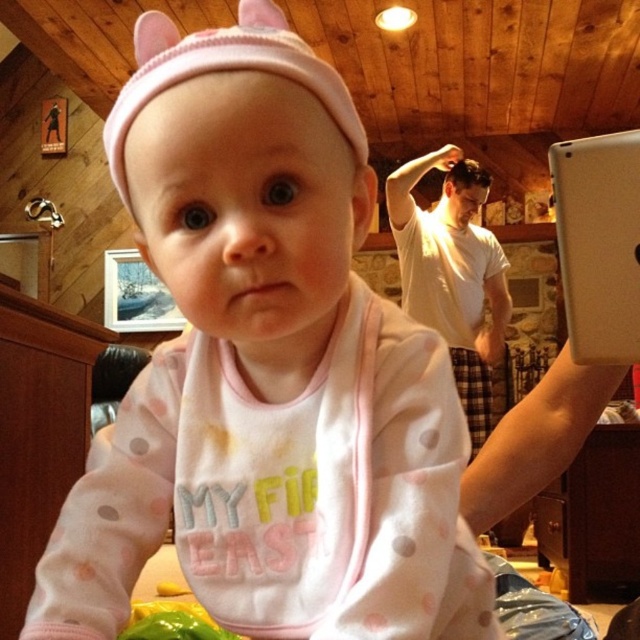
Question: Does pink fabric bib at center have a greater width compared to pink knit hat at upper center?

Choices:
 (A) no
 (B) yes

Answer: (A)

Question: Among these points, which one is nearest to the camera?

Choices:
 (A) (113, 144)
 (B) (616, 340)
 (C) (364, 461)

Answer: (A)

Question: In this image, where is white matte tablet at upper right located relative to pink knit hat at upper center?

Choices:
 (A) left
 (B) right

Answer: (B)

Question: Which of the following is the closest to the observer?

Choices:
 (A) (586, 244)
 (B) (317, 429)
 (C) (134, 108)

Answer: (C)

Question: Can you confirm if white matte tablet at upper right is positioned above pink knit hat at upper center?

Choices:
 (A) no
 (B) yes

Answer: (A)

Question: Which is nearer to the pink knit hat at upper center?

Choices:
 (A) white matte tablet at upper right
 (B) pink fabric bib at center

Answer: (B)